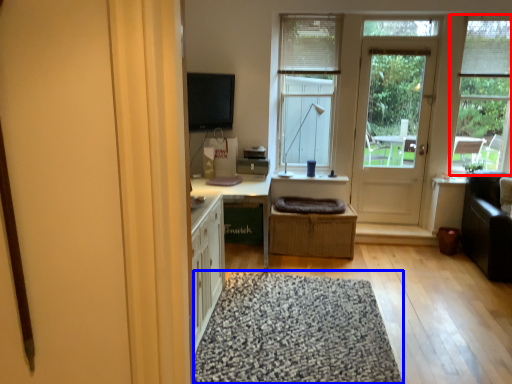
Question: Among these objects, which one is nearest to the camera, window (highlighted by a red box) or doormat (highlighted by a blue box)?

Choices:
 (A) window
 (B) doormat

Answer: (B)